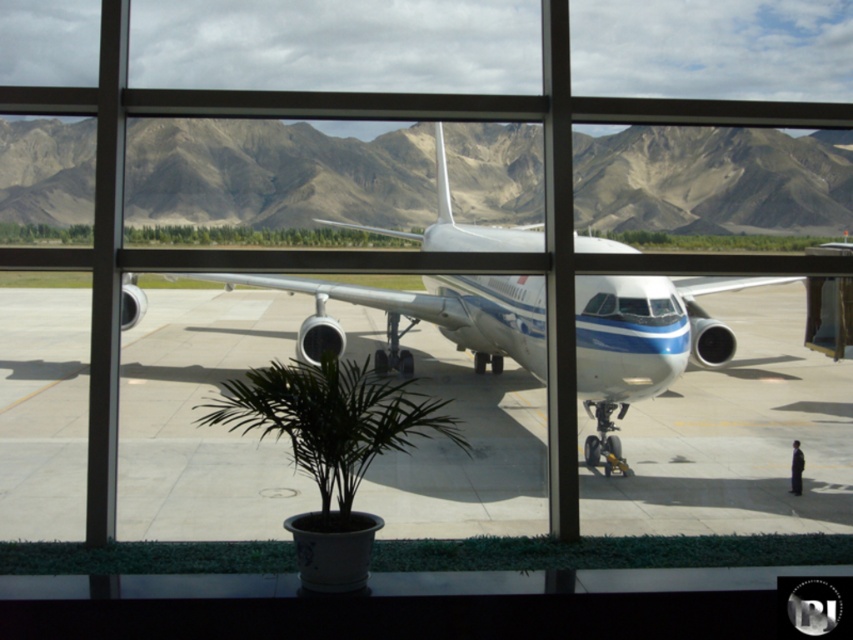
Can you confirm if gray concrete tarmac at center is shorter than white glossy airplane at center?

Correct, gray concrete tarmac at center is not as tall as white glossy airplane at center.

Who is lower down, gray concrete tarmac at center or white glossy airplane at center?

Positioned lower is gray concrete tarmac at center.

Locate an element on the screen. This screenshot has height=640, width=853. gray concrete tarmac at center is located at coordinates (734, 436).

This screenshot has width=853, height=640. Identify the location of gray concrete tarmac at center. (734, 436).